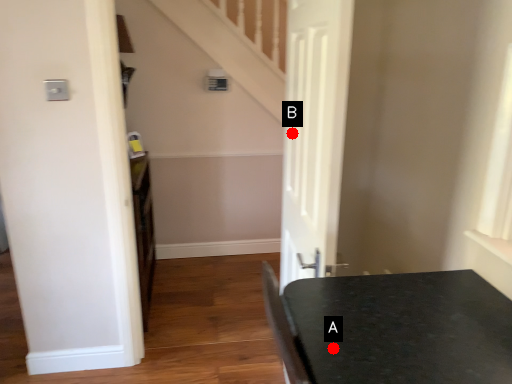
Question: Two points are circled on the image, labeled by A and B beside each circle. Which point is closer to the camera taking this photo?

Choices:
 (A) A is closer
 (B) B is closer

Answer: (A)